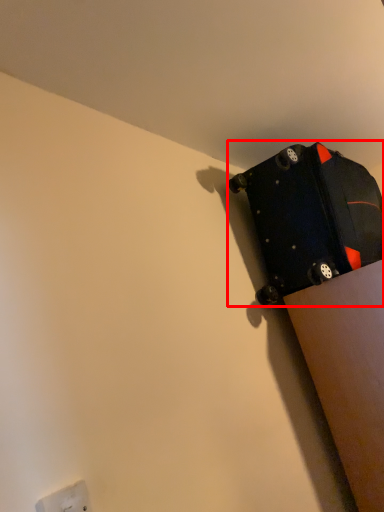
Question: Observing the image, what is the correct spatial positioning of luggage and bags (annotated by the red box) in reference to electric outlet?

Choices:
 (A) left
 (B) right

Answer: (B)